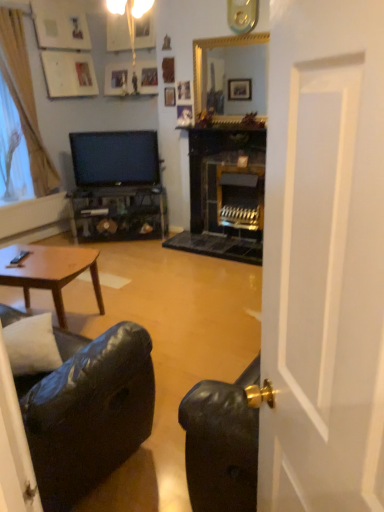
The image size is (384, 512). What do you see at coordinates (32, 345) in the screenshot? I see `white soft pillow at lower left` at bounding box center [32, 345].

Image resolution: width=384 pixels, height=512 pixels. What do you see at coordinates (115, 158) in the screenshot?
I see `matte black tv at center` at bounding box center [115, 158].

The height and width of the screenshot is (512, 384). Describe the element at coordinates (212, 48) in the screenshot. I see `gold-framed mirror at upper center` at that location.

Locate an element on the screen. The image size is (384, 512). wooden picture frame at upper center is located at coordinates (169, 96).

Describe the element at coordinates (50, 272) in the screenshot. I see `brown wooden coffee table at lower left` at that location.

The width and height of the screenshot is (384, 512). What are the coordinates of `silky yellow curtain at left` in the screenshot? It's located at (25, 99).

The width and height of the screenshot is (384, 512). What do you see at coordinates (12, 152) in the screenshot?
I see `transparent plastic window screen at left` at bounding box center [12, 152].

I want to click on white soft pillow at lower left, so click(32, 345).

Find the location of `picture frame that appears on the right of white soft pillow at lower left`. picture frame that appears on the right of white soft pillow at lower left is located at coordinates (169, 96).

Is wooden picture frame at upper center positioned behind white soft pillow at lower left?

Yes, wooden picture frame at upper center is further from the camera.

Which is behind, gold-framed mirror at upper center or black leather couch at lower left?

gold-framed mirror at upper center.

Which is more to the right, gold-framed mirror at upper center or black leather couch at lower left?

From the viewer's perspective, gold-framed mirror at upper center appears more on the right side.

Is gold-framed mirror at upper center taller than black leather couch at lower left?

Incorrect, the height of gold-framed mirror at upper center is not larger of that of black leather couch at lower left.

Which object is thinner, black leather couch at lower left or white soft pillow at lower left?

Thinner between the two is white soft pillow at lower left.

Is black leather couch at lower left at the right side of white soft pillow at lower left?

Incorrect, black leather couch at lower left is not on the right side of white soft pillow at lower left.

Would you say white soft pillow at lower left is part of black leather couch at lower left's contents?

Absolutely, white soft pillow at lower left is inside black leather couch at lower left.

Is white soft pillow at lower left at the back of black leather couch at lower left?

That's right, black leather couch at lower left is facing away from white soft pillow at lower left.

Which object is more forward, matte black tv at center or gold-framed mirror at upper center?

gold-framed mirror at upper center.

In the scene shown: Considering the sizes of objects matte black tv at center and gold-framed mirror at upper center in the image provided, who is thinner, matte black tv at center or gold-framed mirror at upper center?

gold-framed mirror at upper center is thinner.

From the image's perspective, does matte black tv at center appear lower than gold-framed mirror at upper center?

Yes, from the image's perspective, matte black tv at center is below gold-framed mirror at upper center.

Consider the image. Is gold-framed mirror at upper center a part of matte black tv at center?

No.

I want to click on window screen above the black leather couch at lower left (from a real-world perspective), so click(x=12, y=152).

Can you confirm if black leather couch at lower left is positioned to the right of transparent plastic window screen at left?

Yes.

Is black leather couch at lower left looking in the opposite direction of transparent plastic window screen at left?

No, transparent plastic window screen at left is not at the back of black leather couch at lower left.

Measure the distance from black leather couch at lower left to transparent plastic window screen at left.

black leather couch at lower left and transparent plastic window screen at left are 3.30 meters apart.

Which is correct: black leather couch at lower left is inside wooden picture frame at upper center, or outside of it?

The correct answer is: outside.

How different are the orientations of black leather couch at lower left and wooden picture frame at upper center in degrees?

173 degrees.

Looking at this image, considering the relative sizes of black leather couch at lower left and wooden picture frame at upper center in the image provided, is black leather couch at lower left bigger than wooden picture frame at upper center?

Yes.

Can you confirm if black leather couch at lower left is thinner than wooden picture frame at upper center?

Incorrect, the width of black leather couch at lower left is not less than that of wooden picture frame at upper center.

Can you confirm if brown wooden coffee table at lower left is thinner than transparent plastic window screen at left?

No, brown wooden coffee table at lower left is not thinner than transparent plastic window screen at left.

In the scene shown: Which of these two, brown wooden coffee table at lower left or transparent plastic window screen at left, is smaller?

With smaller size is transparent plastic window screen at left.

Considering the relative positions of brown wooden coffee table at lower left and transparent plastic window screen at left in the image provided, is brown wooden coffee table at lower left to the left or to the right of transparent plastic window screen at left?

In the image, brown wooden coffee table at lower left appears on the right side of transparent plastic window screen at left.

Is brown wooden coffee table at lower left shorter than transparent plastic window screen at left?

Yes, brown wooden coffee table at lower left is shorter than transparent plastic window screen at left.

You are a GUI agent. You are given a task and a screenshot of the screen. Output one action in this format:
    pyautogui.click(x=<x>, y=<y>)
    Task: Click on the picture frame behind the white soft pillow at lower left
    This screenshot has width=384, height=512.
    Given the screenshot: What is the action you would take?
    pyautogui.click(x=169, y=96)

Locate an element on the screen. This screenshot has height=512, width=384. studio couch lying on the left of gold-framed mirror at upper center is located at coordinates (88, 411).

From the image, which object appears to be nearer to silky yellow curtain at left, transparent plastic window screen at left or matte black tv at center?

transparent plastic window screen at left lies closer to silky yellow curtain at left than the other object.

Based on their spatial positions, is silky yellow curtain at left or wooden picture frame at upper center further from gold-framed mirror at upper center?

silky yellow curtain at left.

Based on the photo, estimate the real-world distances between objects in this image. Which object is closer to gold-framed mirror at upper center, silky yellow curtain at left or black leather couch at lower left?

The object closer to gold-framed mirror at upper center is silky yellow curtain at left.

Looking at the image, which one is located closer to white soft pillow at lower left, black leather couch at lower left or matte black tv at center?

black leather couch at lower left.

When comparing their distances from white soft pillow at lower left, does wooden picture frame at upper center or transparent plastic window screen at left seem further?

The object further to white soft pillow at lower left is wooden picture frame at upper center.

Looking at the image, which one is located closer to brown wooden coffee table at lower left, gold-framed mirror at upper center or white soft pillow at lower left?

Among the two, white soft pillow at lower left is located nearer to brown wooden coffee table at lower left.

When comparing their distances from black leather couch at lower left, does gold-framed mirror at upper center or transparent plastic window screen at left seem further?

transparent plastic window screen at left lies further to black leather couch at lower left than the other object.

Considering their positions, is transparent plastic window screen at left positioned closer to black leather couch at lower left than wooden picture frame at upper center?

Among the two, transparent plastic window screen at left is located nearer to black leather couch at lower left.

The image size is (384, 512). In order to click on pillow between black leather couch at lower left and brown wooden coffee table at lower left along the z-axis in this screenshot , I will do `click(32, 345)`.

You are a GUI agent. You are given a task and a screenshot of the screen. Output one action in this format:
    pyautogui.click(x=<x>, y=<y>)
    Task: Click on the coffee table between black leather couch at lower left and gold-framed mirror at upper center in the front-back direction
    
    Given the screenshot: What is the action you would take?
    pyautogui.click(x=50, y=272)

Image resolution: width=384 pixels, height=512 pixels. In order to click on coffee table between white soft pillow at lower left and wooden picture frame at upper center along the z-axis in this screenshot , I will do `click(50, 272)`.

The width and height of the screenshot is (384, 512). In order to click on fireplace between wooden picture frame at upper center and brown wooden coffee table at lower left vertically in this screenshot , I will do `click(212, 48)`.